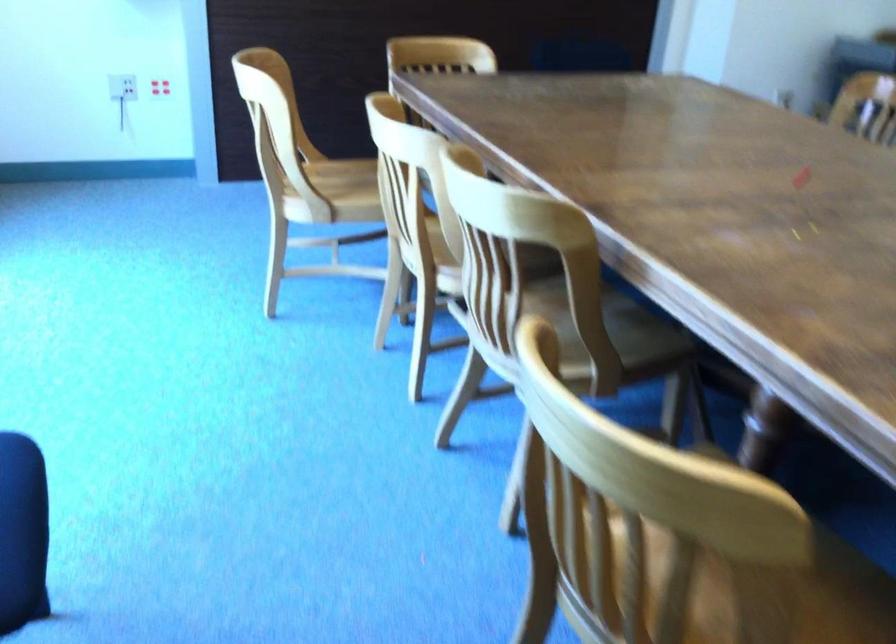
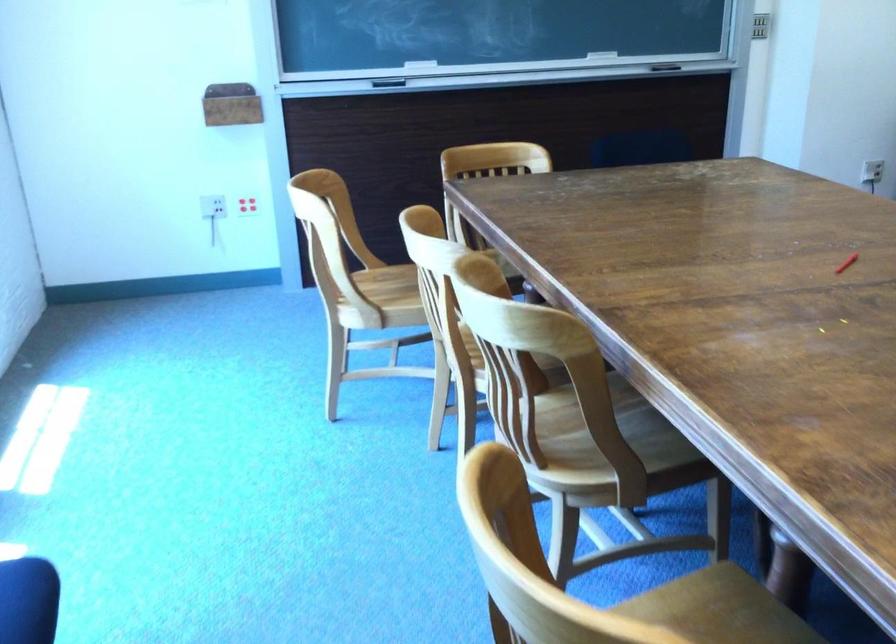
In the second image, find the point that corresponds to point (268, 163) in the first image.

(328, 276)